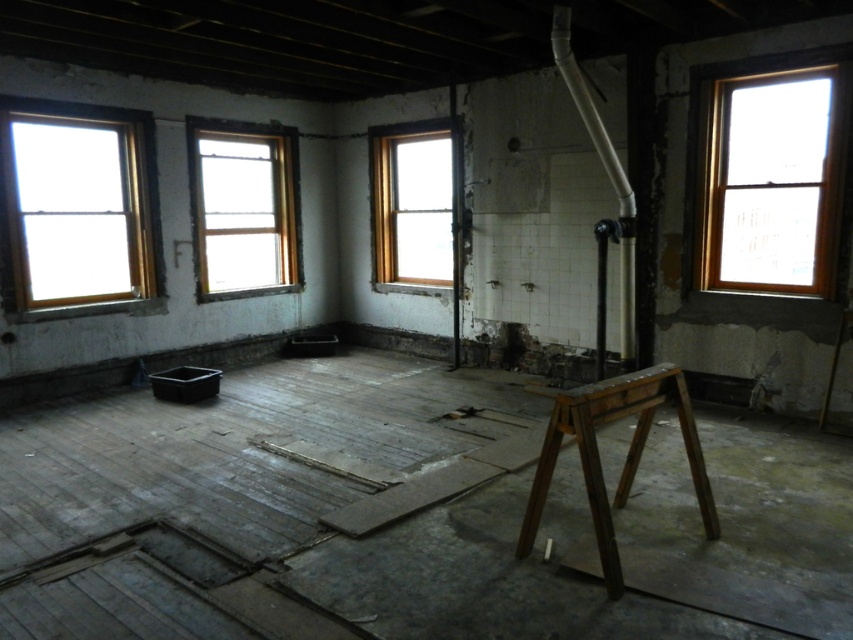
Question: Which object appears closest to the camera in this image?

Choices:
 (A) clear glass window at left
 (B) clear glass window at center
 (C) dark brown wooden stool at center

Answer: (C)

Question: Can you confirm if clear glass window at left is thinner than wooden frame window at upper right?

Choices:
 (A) no
 (B) yes

Answer: (A)

Question: Which object is positioned closest to the clear glass window at center?

Choices:
 (A) wooden frame window at center
 (B) wooden frame window at upper right

Answer: (A)

Question: Can you confirm if clear glass window at left is smaller than dark brown wooden stool at center?

Choices:
 (A) yes
 (B) no

Answer: (B)

Question: Which object is closer to the camera taking this photo?

Choices:
 (A) wooden frame window at center
 (B) wooden frame window at upper right
 (C) dark brown wooden stool at center

Answer: (C)

Question: Does clear glass window at left have a greater width compared to dark brown wooden stool at center?

Choices:
 (A) no
 (B) yes

Answer: (A)